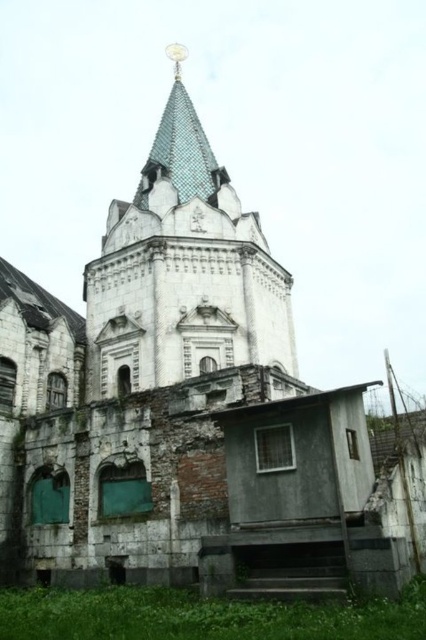
You are a construction worker standing at the base of the white stone tower at center. You need to reach the blue tiled spire at upper center to inspect it. What is the vertical distance you need to climb?

The vertical distance between the white stone tower at center and the blue tiled spire at upper center is 6.39 meters, so you need to climb 6.39 meters vertically.

You are an architect examining the ruins of an old church. You notice the white stone tower at center and the blue tiled spire at upper center. From your vantage point, which object is located to the left of the other?

The white stone tower at center is positioned on the right side of blue tiled spire at upper center, so the blue tiled spire at upper center is to the left of the white stone tower at center.